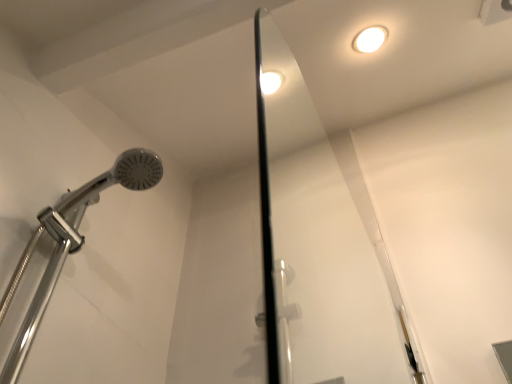
Find the location of a particular element. The image size is (512, 384). polished chrome shower head at upper left is located at coordinates (69, 243).

Describe the element at coordinates (69, 243) in the screenshot. I see `polished chrome shower head at upper left` at that location.

Where is `polished chrome shower head at upper left`? The image size is (512, 384). polished chrome shower head at upper left is located at coordinates (69, 243).